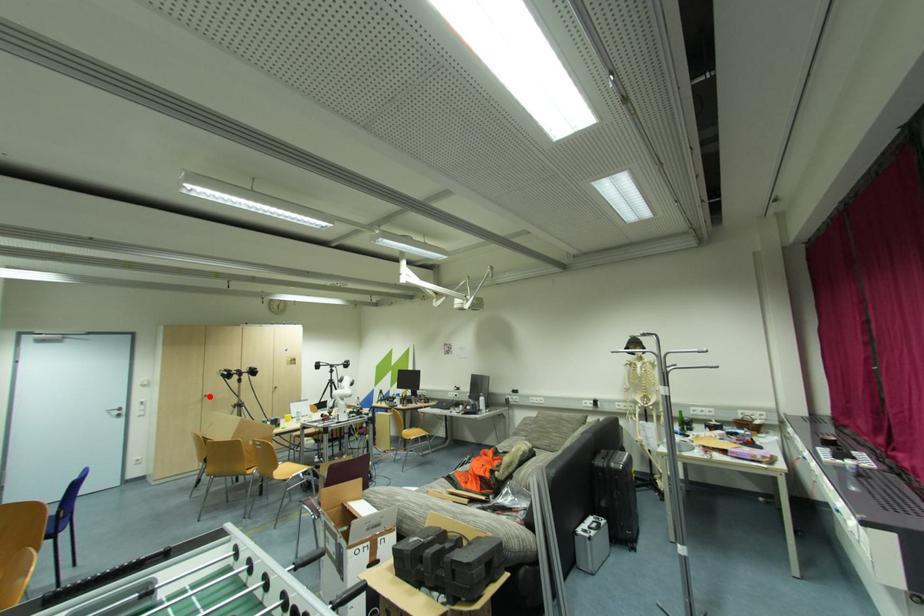
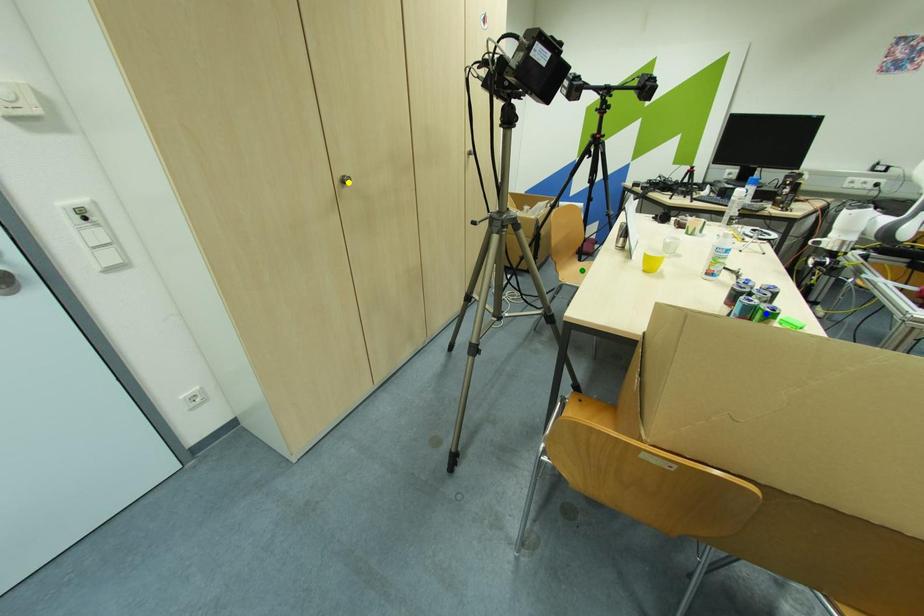
Question: I am providing you with two images of the same scene from different viewpoints. A red point is marked on the first image. You are given multiple points on the second image. In image 2, which mark is for the same physical point as the one in image 1?

Choices:
 (A) yellow point
 (B) green point
 (C) blue point

Answer: (A)